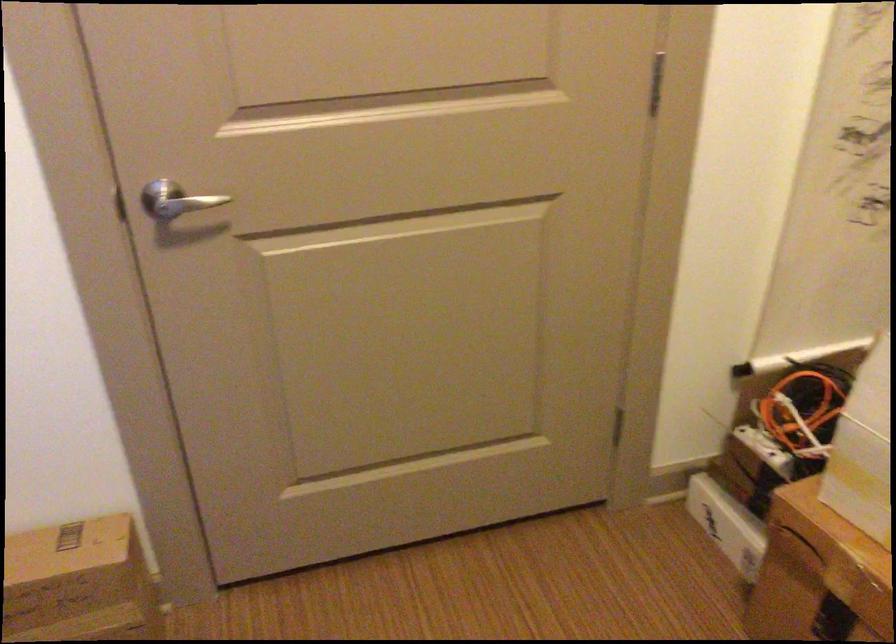
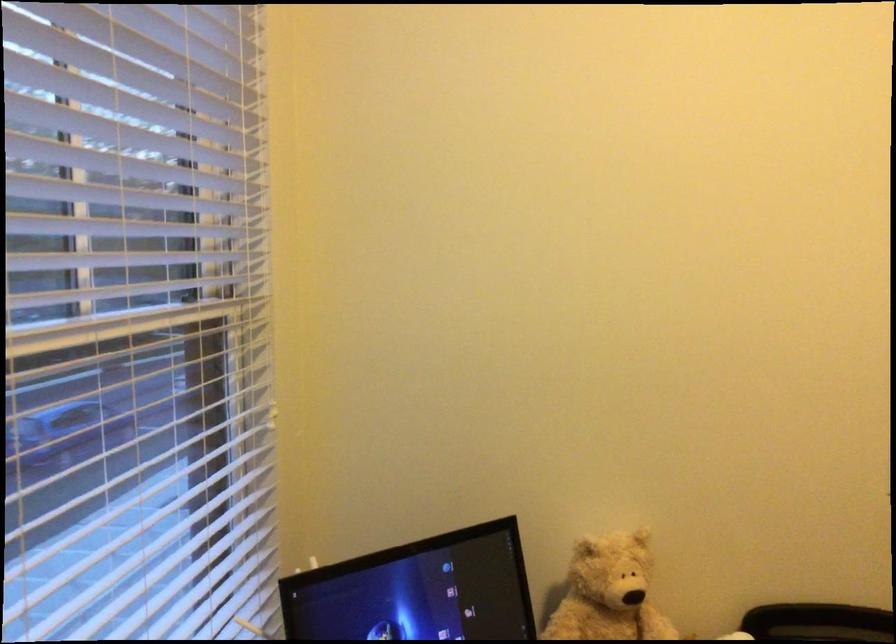
First-person continuous shooting, in which direction is the camera rotating?

The camera's rotation is toward left-down.